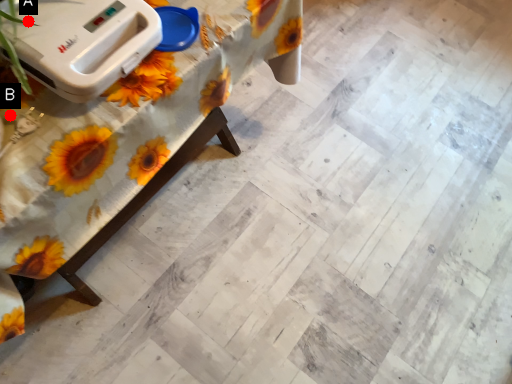
Question: Two points are circled on the image, labeled by A and B beside each circle. Which point is closer to the camera taking this photo?

Choices:
 (A) A is closer
 (B) B is closer

Answer: (A)